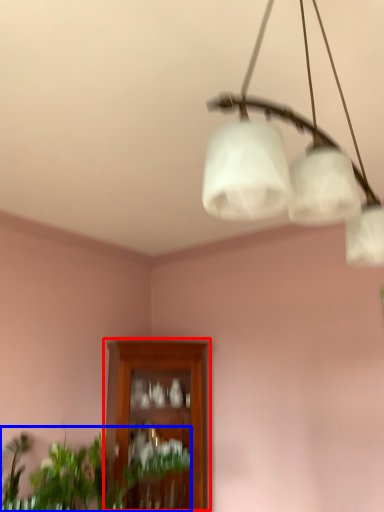
Question: Which of the following is the closest to the observer, cabinetry (highlighted by a red box) or houseplant (highlighted by a blue box)?

Choices:
 (A) cabinetry
 (B) houseplant

Answer: (B)